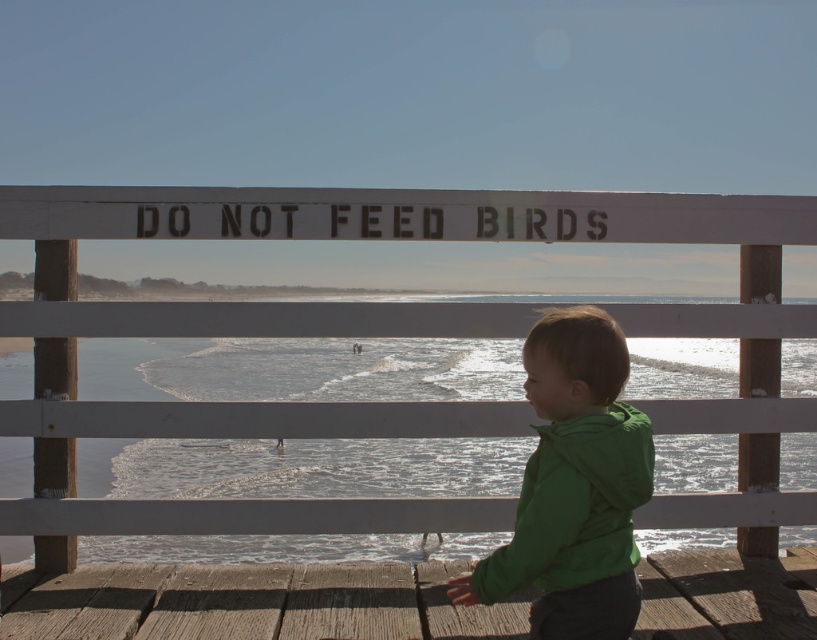
Can you confirm if wooden dock at lower center is positioned below green matte jacket at lower right?

Indeed, wooden dock at lower center is positioned under green matte jacket at lower right.

Between point (434, 579) and point (615, 577), which one is positioned behind?

Point (434, 579)

Find the location of a particular element. wooden dock at lower center is located at coordinates (253, 602).

In the scene shown: Which is more to the left, wooden dock at lower center or clear water at lower center?

wooden dock at lower center is more to the left.

You are a GUI agent. You are given a task and a screenshot of the screen. Output one action in this format:
    pyautogui.click(x=<x>, y=<y>)
    Task: Click on the wooden dock at lower center
    
    Given the screenshot: What is the action you would take?
    pyautogui.click(x=253, y=602)

Which is behind, point (266, 593) or point (268, 426)?

Point (268, 426)

The width and height of the screenshot is (817, 640). I want to click on wooden dock at lower center, so click(x=253, y=602).

Who is taller, green matte jacket at lower right or clear water at lower center?

Standing taller between the two is clear water at lower center.

Which of these two, green matte jacket at lower right or clear water at lower center, stands shorter?

green matte jacket at lower right is shorter.

Is point (605, 406) more distant than point (748, 413)?

No, it is in front of (748, 413).

I want to click on green matte jacket at lower right, so click(x=574, y=486).